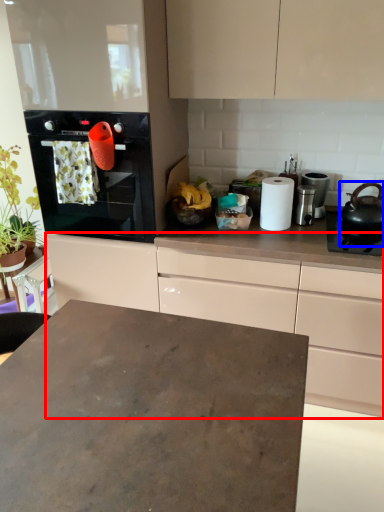
Question: Among these objects, which one is nearest to the camera, cabinetry (highlighted by a red box) or kitchen appliance (highlighted by a blue box)?

Choices:
 (A) cabinetry
 (B) kitchen appliance

Answer: (A)